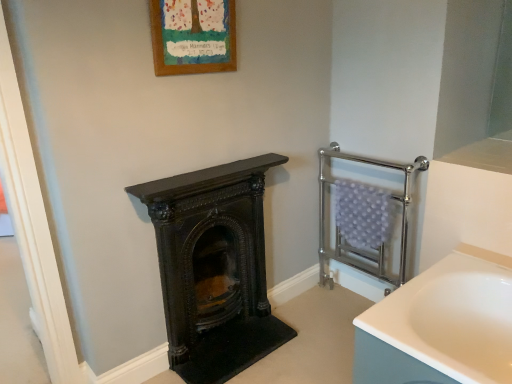
What do you see at coordinates (341, 230) in the screenshot? I see `chrome metallic towel rack at right` at bounding box center [341, 230].

Where is `wooden frame at upper center`? The image size is (512, 384). wooden frame at upper center is located at coordinates (193, 36).

The image size is (512, 384). I want to click on chrome metallic towel rack at right, so click(x=341, y=230).

Is chrome metallic towel rack at right touching black polished wood burning stove at center?

No, chrome metallic towel rack at right is not touching black polished wood burning stove at center.

Does point (406, 215) appear closer or farther from the camera than point (193, 373)?

Point (406, 215).

Can we say chrome metallic towel rack at right lies outside black polished wood burning stove at center?

Yes, chrome metallic towel rack at right is outside of black polished wood burning stove at center.

Is chrome metallic towel rack at right oriented away from black polished wood burning stove at center?

No.

From a real-world perspective, is wooden frame at upper center above or below chrome metallic towel rack at right?

In terms of real-world spatial position, wooden frame at upper center is above chrome metallic towel rack at right.

Considering the relative positions of wooden frame at upper center and chrome metallic towel rack at right in the image provided, is wooden frame at upper center behind chrome metallic towel rack at right?

No, wooden frame at upper center is closer to the viewer.

Considering the points (220, 15) and (374, 273), which point is behind, point (220, 15) or point (374, 273)?

Point (374, 273)

How different are the orientations of wooden frame at upper center and chrome metallic towel rack at right in degrees?

The angle between the facing direction of wooden frame at upper center and the facing direction of chrome metallic towel rack at right is 90.3 degrees.

Could you tell me if wooden frame at upper center is turned towards black polished wood burning stove at center?

No.

Consider the image. Is wooden frame at upper center behind black polished wood burning stove at center?

No, wooden frame at upper center is closer to the viewer.

Is wooden frame at upper center not within black polished wood burning stove at center?

Yes.

Which of these two, wooden frame at upper center or black polished wood burning stove at center, is bigger?

Bigger between the two is black polished wood burning stove at center.

How much distance is there between chrome metallic towel rack at right and wooden frame at upper center?

They are 3.44 feet apart.

Image resolution: width=512 pixels, height=384 pixels. Identify the location of picture frame above the chrome metallic towel rack at right (from a real-world perspective). (193, 36).

Considering the sizes of objects chrome metallic towel rack at right and wooden frame at upper center in the image provided, who is thinner, chrome metallic towel rack at right or wooden frame at upper center?

With smaller width is wooden frame at upper center.

From a real-world perspective, is black polished wood burning stove at center positioned above or below chrome metallic towel rack at right?

black polished wood burning stove at center is situated lower than chrome metallic towel rack at right in the real world.

Is black polished wood burning stove at center next to chrome metallic towel rack at right?

No, black polished wood burning stove at center is not next to chrome metallic towel rack at right.

What's the angular difference between black polished wood burning stove at center and chrome metallic towel rack at right's facing directions?

The angle between the facing direction of black polished wood burning stove at center and the facing direction of chrome metallic towel rack at right is 89.3 degrees.

Is black polished wood burning stove at center positioned behind chrome metallic towel rack at right?

No, black polished wood burning stove at center is closer to the camera.

This screenshot has height=384, width=512. In the image, there is a black polished wood burning stove at center. In order to click on picture frame above it (from the image's perspective) in this screenshot , I will do `click(193, 36)`.

Between black polished wood burning stove at center and wooden frame at upper center, which one appears on the left side from the viewer's perspective?

Positioned to the left is wooden frame at upper center.

Is wooden frame at upper center surrounded by black polished wood burning stove at center?

No, black polished wood burning stove at center does not contain wooden frame at upper center.

You are a GUI agent. You are given a task and a screenshot of the screen. Output one action in this format:
    pyautogui.click(x=<x>, y=<y>)
    Task: Click on the wood burning stove located on the left of chrome metallic towel rack at right
    This screenshot has width=512, height=384.
    Given the screenshot: What is the action you would take?
    pyautogui.click(x=214, y=268)

I want to click on picture frame located above the chrome metallic towel rack at right (from the image's perspective), so click(193, 36).

Estimate the real-world distances between objects in this image. Which object is closer to chrome metallic towel rack at right, black polished wood burning stove at center or wooden frame at upper center?

Among the two, black polished wood burning stove at center is located nearer to chrome metallic towel rack at right.

Estimate the real-world distances between objects in this image. Which object is further from wooden frame at upper center, chrome metallic towel rack at right or black polished wood burning stove at center?

The object further to wooden frame at upper center is chrome metallic towel rack at right.

Considering their positions, is black polished wood burning stove at center positioned further to wooden frame at upper center than chrome metallic towel rack at right?

chrome metallic towel rack at right is positioned further to the anchor wooden frame at upper center.

Which object lies nearer to the anchor point chrome metallic towel rack at right, wooden frame at upper center or black polished wood burning stove at center?

black polished wood burning stove at center.

Looking at the image, which one is located closer to black polished wood burning stove at center, chrome metallic towel rack at right or wooden frame at upper center?

The object closer to black polished wood burning stove at center is chrome metallic towel rack at right.

Looking at the image, which one is located further to black polished wood burning stove at center, wooden frame at upper center or chrome metallic towel rack at right?

Based on the image, wooden frame at upper center appears to be further to black polished wood burning stove at center.

I want to click on balustrade between wooden frame at upper center and black polished wood burning stove at center in the vertical direction, so click(341, 230).